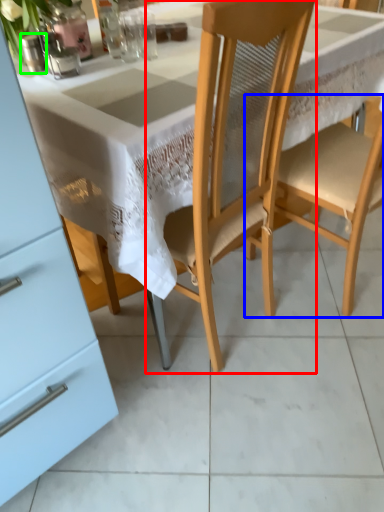
Question: Considering the real-world distances, which object is farthest from chair (highlighted by a red box)? chair (highlighted by a blue box) or tableware (highlighted by a green box)?

Choices:
 (A) chair
 (B) tableware

Answer: (B)